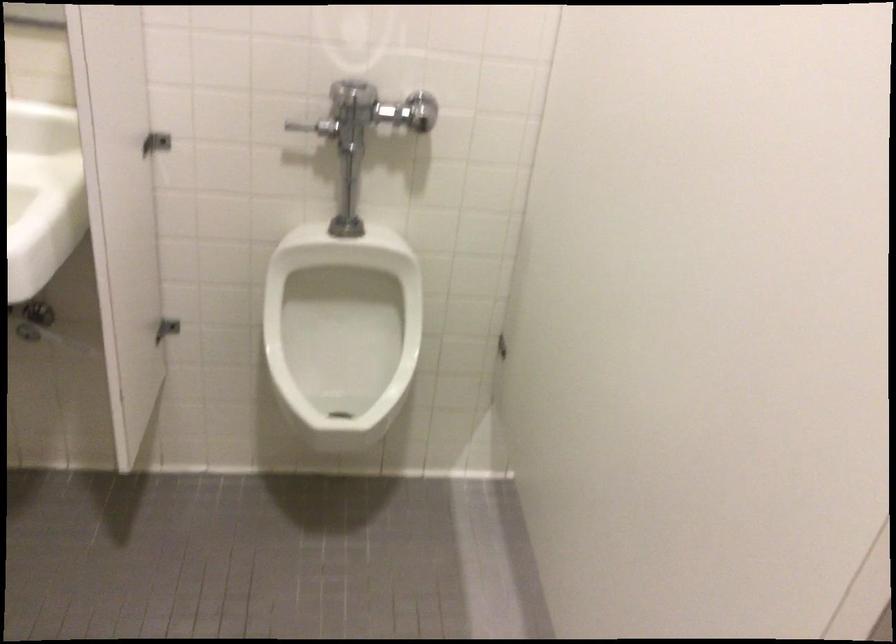
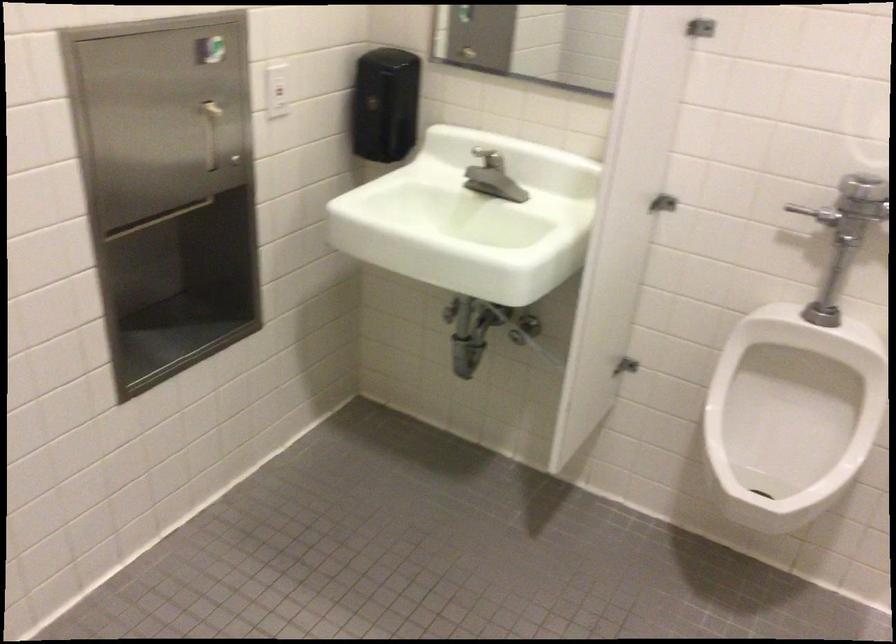
Question: Based on the continuous images, in which direction is the camera rotating? Reply with the corresponding letter.

Choices:
 (A) Left
 (B) Right
 (C) Up
 (D) Down

Answer: (A)